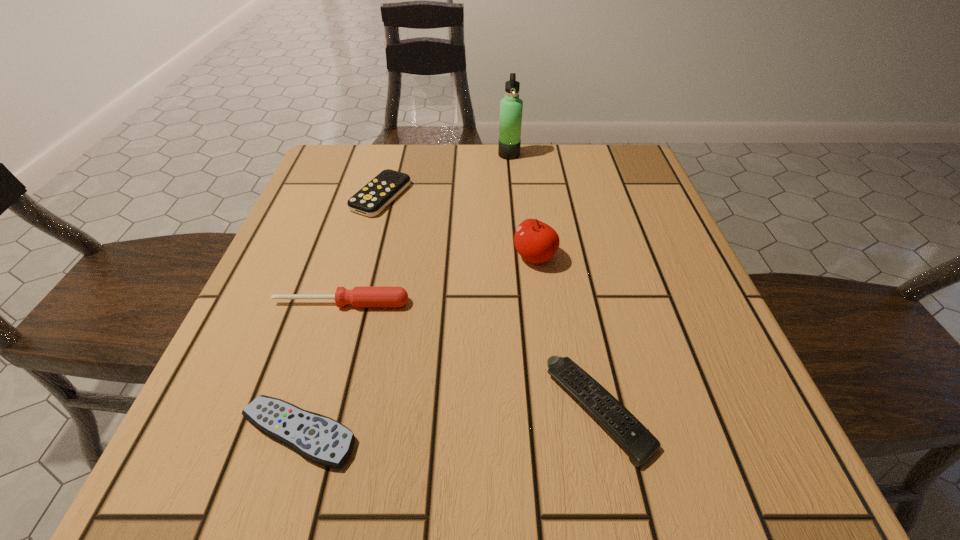
You are a GUI agent. You are given a task and a screenshot of the screen. Output one action in this format:
    pyautogui.click(x=<x>, y=<y>)
    Task: Click on the free location that satisfies the following two spatial constraints: 1. on the back side of the farthest remote control; 2. on the right side of the thermos bottle
    The image size is (960, 540).
    Given the screenshot: What is the action you would take?
    pyautogui.click(x=393, y=154)

Image resolution: width=960 pixels, height=540 pixels. Find the location of `free space that satisfies the following two spatial constraints: 1. on the front side of the second farthest object; 2. on the left side of the rightmost remote control`. free space that satisfies the following two spatial constraints: 1. on the front side of the second farthest object; 2. on the left side of the rightmost remote control is located at coordinates (323, 409).